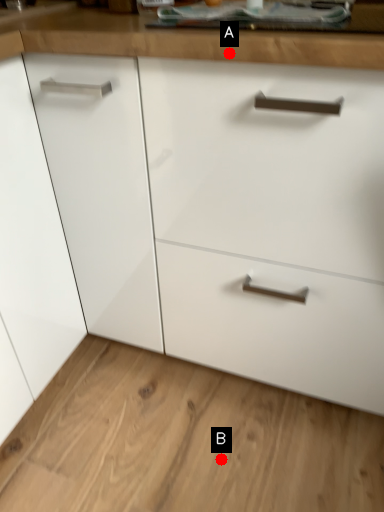
Question: Two points are circled on the image, labeled by A and B beside each circle. Which of the following is the farthest from the observer?

Choices:
 (A) A is further
 (B) B is further

Answer: (B)